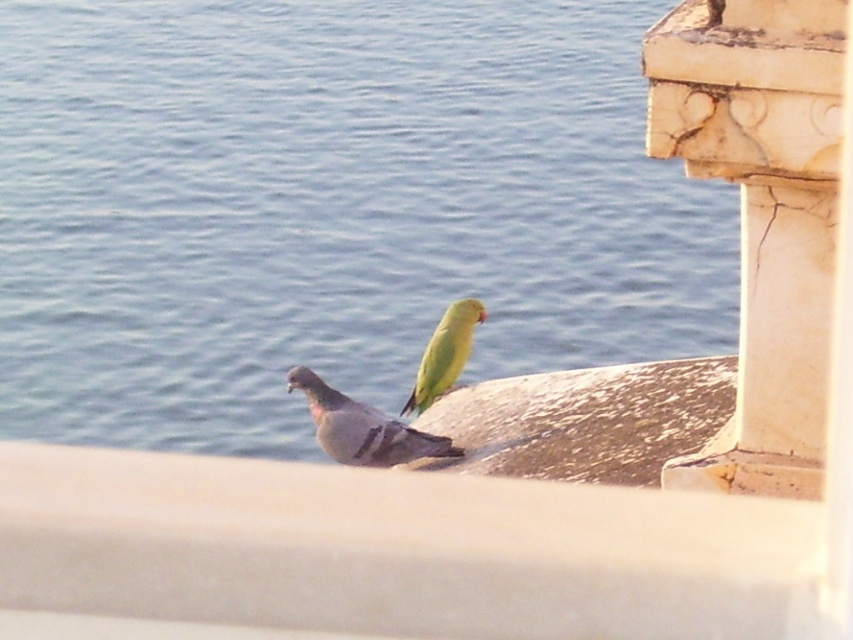
Between point (511, 221) and point (779, 394), which one is positioned in front?

Point (779, 394) is in front.

The image size is (853, 640). Describe the element at coordinates (329, 209) in the screenshot. I see `blue water at center` at that location.

This screenshot has height=640, width=853. In order to click on blue water at center in this screenshot , I will do `click(329, 209)`.

Which is below, white marble pillar at upper right or gray matte pigeon at center?

gray matte pigeon at center is below.

Which is behind, point (793, 22) or point (343, 426)?

Positioned behind is point (343, 426).

Who is more forward, (x=763, y=12) or (x=320, y=445)?

Point (x=763, y=12) is more forward.

This screenshot has height=640, width=853. In order to click on white marble pillar at upper right in this screenshot , I will do `click(761, 216)`.

Who is positioned more to the left, gray matte pigeon at center or green matte parrot at center?

From the viewer's perspective, gray matte pigeon at center appears more on the left side.

Can you confirm if gray matte pigeon at center is shorter than green matte parrot at center?

Indeed, gray matte pigeon at center has a lesser height compared to green matte parrot at center.

Is point (373, 445) in front of point (462, 369)?

Yes, it is in front of point (462, 369).

This screenshot has height=640, width=853. I want to click on gray matte pigeon at center, so click(363, 428).